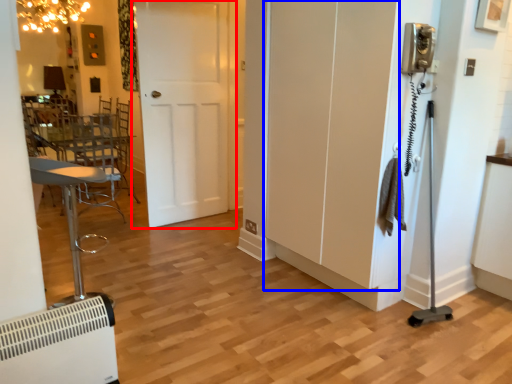
Question: Which point is further to the camera, door (highlighted by a red box) or screen door (highlighted by a blue box)?

Choices:
 (A) door
 (B) screen door

Answer: (A)